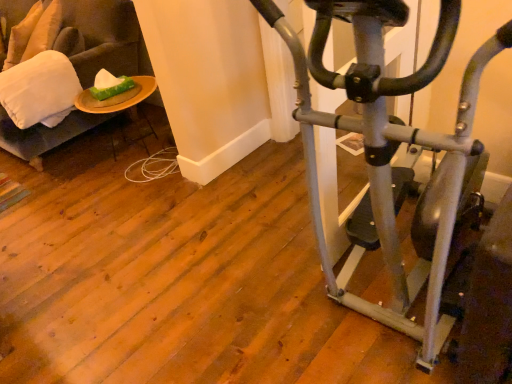
Question: From the image's perspective, would you say wooden plate at left is positioned over soft beige pillow at upper left, marked as the second pillow in a right-to-left arrangement?

Choices:
 (A) yes
 (B) no

Answer: (B)

Question: Does wooden plate at left come behind soft beige pillow at upper left, acting as the second pillow starting from the bottom?

Choices:
 (A) yes
 (B) no

Answer: (B)

Question: Is soft beige pillow at upper left, positioned as the first pillow in back-to-front order, completely or partially inside wooden plate at left?

Choices:
 (A) yes
 (B) no

Answer: (B)

Question: Is wooden plate at left oriented away from soft beige pillow at upper left, marked as the second pillow in a right-to-left arrangement?

Choices:
 (A) no
 (B) yes

Answer: (A)

Question: From the image's perspective, would you say wooden plate at left is shown under soft beige pillow at upper left, acting as the second pillow starting from the bottom?

Choices:
 (A) yes
 (B) no

Answer: (A)

Question: In terms of size, does wooden plate at left appear bigger or smaller than green matte tissue at upper left?

Choices:
 (A) big
 (B) small

Answer: (A)

Question: Is wooden plate at left taller or shorter than green matte tissue at upper left?

Choices:
 (A) short
 (B) tall

Answer: (B)

Question: Is wooden plate at left in front of or behind green matte tissue at upper left in the image?

Choices:
 (A) behind
 (B) front

Answer: (B)

Question: From the image's perspective, is wooden plate at left above or below green matte tissue at upper left?

Choices:
 (A) below
 (B) above

Answer: (A)

Question: Considering the positions of soft beige pillow at upper left, positioned as the first pillow in back-to-front order, and silver metallic stationary bicycle at right in the image, is soft beige pillow at upper left, positioned as the first pillow in back-to-front order, wider or thinner than silver metallic stationary bicycle at right?

Choices:
 (A) thin
 (B) wide

Answer: (A)

Question: From the image's perspective, relative to silver metallic stationary bicycle at right, is soft beige pillow at upper left, which is the 1th pillow from left to right, above or below?

Choices:
 (A) below
 (B) above

Answer: (B)

Question: Is soft beige pillow at upper left, positioned as the 1th pillow in top-to-bottom order, spatially inside silver metallic stationary bicycle at right, or outside of it?

Choices:
 (A) inside
 (B) outside

Answer: (B)

Question: In terms of size, does soft beige pillow at upper left, positioned as the first pillow in back-to-front order, appear bigger or smaller than silver metallic stationary bicycle at right?

Choices:
 (A) big
 (B) small

Answer: (B)

Question: Is velvet beige swivel chair at left taller or shorter than silver metallic stationary bicycle at right?

Choices:
 (A) short
 (B) tall

Answer: (A)

Question: From a real-world perspective, is velvet beige swivel chair at left physically located above or below silver metallic stationary bicycle at right?

Choices:
 (A) above
 (B) below

Answer: (B)